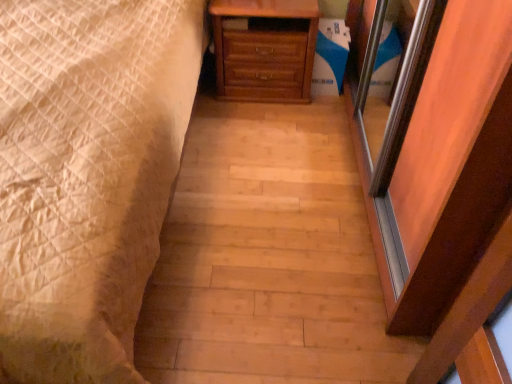
In order to click on wooden chest of drawers at center in this screenshot , I will do `click(265, 49)`.

Measure the distance between point (278, 70) and camera.

Point (278, 70) and camera are 7.44 feet apart from each other.

What do you see at coordinates (265, 49) in the screenshot? This screenshot has width=512, height=384. I see `wooden chest of drawers at center` at bounding box center [265, 49].

This screenshot has width=512, height=384. What do you see at coordinates (87, 175) in the screenshot?
I see `white quilted bed at left` at bounding box center [87, 175].

The height and width of the screenshot is (384, 512). Find the location of `white quilted bed at left`. white quilted bed at left is located at coordinates (87, 175).

This screenshot has width=512, height=384. What are the coordinates of `wooden chest of drawers at center` in the screenshot? It's located at (265, 49).

Based on their positions, is white quilted bed at left located to the left or right of wooden chest of drawers at center?

white quilted bed at left is positioned on wooden chest of drawers at center's left side.

Considering the positions of objects white quilted bed at left and wooden chest of drawers at center in the image provided, who is behind, white quilted bed at left or wooden chest of drawers at center?

wooden chest of drawers at center.

From the picture: Which point is more distant from viewer, (x=42, y=219) or (x=259, y=38)?

Positioned behind is point (x=259, y=38).

From the image's perspective, is white quilted bed at left located above or below wooden chest of drawers at center?

white quilted bed at left is situated lower than wooden chest of drawers at center in the image.

From a real-world perspective, is white quilted bed at left below wooden chest of drawers at center?

No, from a real-world perspective, white quilted bed at left is not under wooden chest of drawers at center.

In terms of width, does white quilted bed at left look wider or thinner when compared to wooden chest of drawers at center?

In the image, white quilted bed at left appears to be wider than wooden chest of drawers at center.

In terms of height, does white quilted bed at left look taller or shorter compared to wooden chest of drawers at center?

Clearly, white quilted bed at left is taller compared to wooden chest of drawers at center.

Does white quilted bed at left have a smaller size compared to wooden chest of drawers at center?

Actually, white quilted bed at left might be larger than wooden chest of drawers at center.

Is wooden chest of drawers at center located within white quilted bed at left?

Definitely not — wooden chest of drawers at center is not inside white quilted bed at left.

Based on the photo, does white quilted bed at left touch wooden chest of drawers at center?

No, white quilted bed at left is not making contact with wooden chest of drawers at center.

Could you tell me if white quilted bed at left is facing wooden chest of drawers at center?

No, white quilted bed at left does not turn towards wooden chest of drawers at center.

Can you tell me how much white quilted bed at left and wooden chest of drawers at center differ in facing direction?

They differ by 0.391 degrees in their facing directions.

Measure the distance from white quilted bed at left to wooden chest of drawers at center.

white quilted bed at left is 72.57 centimeters away from wooden chest of drawers at center.

Where is `bed above the wooden chest of drawers at center (from a real-world perspective)`? The width and height of the screenshot is (512, 384). bed above the wooden chest of drawers at center (from a real-world perspective) is located at coordinates (87, 175).

Does wooden chest of drawers at center appear on the left side of white quilted bed at left?

Incorrect, wooden chest of drawers at center is not on the left side of white quilted bed at left.

Which object is closer to the camera taking this photo, wooden chest of drawers at center or white quilted bed at left?

white quilted bed at left is closer to the camera.

Is point (240, 3) in front of point (126, 371)?

No, (240, 3) is behind (126, 371).

From the image's perspective, which is below, wooden chest of drawers at center or white quilted bed at left?

From the image's view, white quilted bed at left is below.

In the scene shown: From a real-world perspective, which is physically below, wooden chest of drawers at center or white quilted bed at left?

wooden chest of drawers at center, from a real-world perspective.

Considering the sizes of objects wooden chest of drawers at center and white quilted bed at left in the image provided, who is wider, wooden chest of drawers at center or white quilted bed at left?

white quilted bed at left is wider.

Can you confirm if wooden chest of drawers at center is shorter than white quilted bed at left?

Yes, wooden chest of drawers at center is shorter than white quilted bed at left.

Consider the image. Between wooden chest of drawers at center and white quilted bed at left, which one has larger size?

Bigger between the two is white quilted bed at left.

Is wooden chest of drawers at center completely or partially outside of white quilted bed at left?

Yes, wooden chest of drawers at center is not within white quilted bed at left.

Would you say wooden chest of drawers at center is a long distance from white quilted bed at left?

No, wooden chest of drawers at center is not far away from white quilted bed at left.

Is wooden chest of drawers at center oriented away from white quilted bed at left?

That's not correct — wooden chest of drawers at center is not looking away from white quilted bed at left.

How many degrees apart are the facing directions of wooden chest of drawers at center and white quilted bed at left?

0.391 degrees.

Locate an element on the screen. The image size is (512, 384). bed below the wooden chest of drawers at center (from the image's perspective) is located at coordinates (87, 175).

Identify the location of bed lying on the left of wooden chest of drawers at center. (87, 175).

Find the location of a particular element. This screenshot has height=384, width=512. chest of drawers that is on the right side of white quilted bed at left is located at coordinates (265, 49).